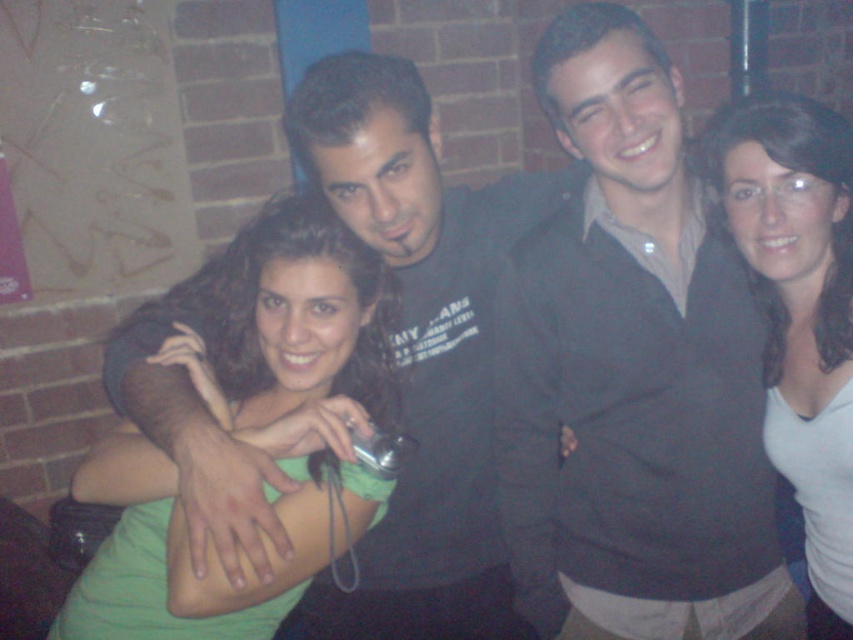
You are a photographer trying to adjust the focus of your camera. You want to ensure both the matte black hoodie at center and the green matte shirt at center are in focus. Given that your camera has a depth of field that can cover 10 inches, will both items be in focus?

The matte black hoodie at center and green matte shirt at center are 10.14 inches apart. Since the distance between them exceeds the camera depth of field of 10 inches, they might not both be in focus simultaneously.

You are organizing a photo shoot and need to ensure all participants are visible. Given the current arrangement of the dark gray sweater at center and the white matte shirt at right, which participant should you ask to move slightly to the left to create more space?

The dark gray sweater at center has a greater width than the white matte shirt at right. To create more space, you should ask the dark gray sweater at center to move slightly to the left since it occupies more horizontal space.

You are standing in a dimly lit room with a brick wall behind you. You see four people posing closely together. There is a point marked at coordinates (421,349). Which object from the list below is this point located on? The options are the light green top on the far left, the dark shirt with text next to it, the matte black hoodie at center, or the person on the far right dressed in dark clothing.

The point marked at coordinates (421,349) is located on the matte black hoodie at center.